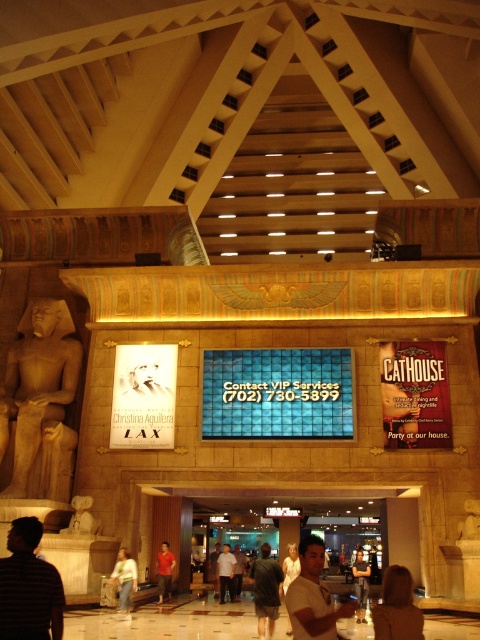
Question: Does polished beige statue at left appear on the left side of denim jeans at center?

Choices:
 (A) no
 (B) yes

Answer: (B)

Question: Can you confirm if dark striped shirt at lower left is bigger than orange t-shirt at center?

Choices:
 (A) yes
 (B) no

Answer: (A)

Question: Based on their relative distances, which object is nearer to the blonde hair at lower right?

Choices:
 (A) orange t-shirt at center
 (B) dark striped shirt at lower left

Answer: (B)

Question: Based on their relative distances, which object is farther from the blonde hair at lower right?

Choices:
 (A) white t-shirt at center
 (B) denim jeans at center
 (C) dark striped shirt at lower left
 (D) dark gray fabric shirt at center

Answer: (C)

Question: Estimate the real-world distances between objects in this image. Which object is closer to the blonde hair at lower right?

Choices:
 (A) dark gray t-shirt at center
 (B) polished beige statue at left
 (C) dark gray fabric shirt at center
 (D) denim jeans at center

Answer: (C)

Question: Is white t-shirt at center positioned at the back of blonde hair at lower right?

Choices:
 (A) yes
 (B) no

Answer: (A)